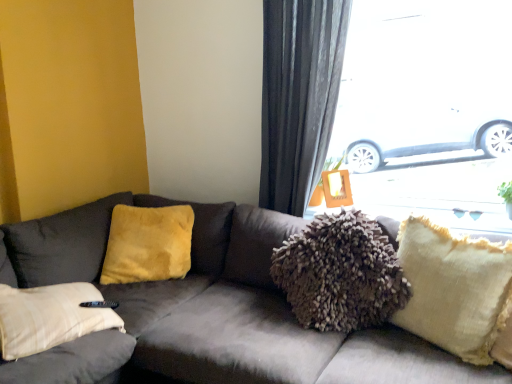
Question: Is dark gray fabric curtain at upper right bigger than beige textured pillow at right, which appears as the second pillow when viewed from the back?

Choices:
 (A) yes
 (B) no

Answer: (A)

Question: Does dark gray fabric curtain at upper right have a lesser height compared to beige textured pillow at right, the second pillow when ordered from left to right?

Choices:
 (A) no
 (B) yes

Answer: (A)

Question: Is dark gray fabric curtain at upper right closer to camera compared to beige textured pillow at right, the second pillow when ordered from left to right?

Choices:
 (A) no
 (B) yes

Answer: (A)

Question: Is dark gray fabric curtain at upper right at the left side of beige textured pillow at right, which is the first pillow from right to left?

Choices:
 (A) yes
 (B) no

Answer: (A)

Question: From the image's perspective, does dark gray fabric curtain at upper right appear lower than beige textured pillow at right, which appears as the second pillow when viewed from the back?

Choices:
 (A) yes
 (B) no

Answer: (B)

Question: Could you tell me if dark gray fabric curtain at upper right is facing beige textured pillow at right, which appears as the second pillow when viewed from the back?

Choices:
 (A) yes
 (B) no

Answer: (B)

Question: Is the position of transparent glass window at upper right less distant than that of fuzzy fabric pillow at upper right?

Choices:
 (A) no
 (B) yes

Answer: (B)

Question: From the image's perspective, is transparent glass window at upper right beneath fuzzy fabric pillow at upper right?

Choices:
 (A) no
 (B) yes

Answer: (A)

Question: Is transparent glass window at upper right positioned far away from fuzzy fabric pillow at upper right?

Choices:
 (A) no
 (B) yes

Answer: (A)

Question: Does transparent glass window at upper right have a greater height compared to fuzzy fabric pillow at upper right?

Choices:
 (A) no
 (B) yes

Answer: (B)

Question: Is transparent glass window at upper right turned away from fuzzy fabric pillow at upper right?

Choices:
 (A) no
 (B) yes

Answer: (A)

Question: Is the surface of transparent glass window at upper right in direct contact with fuzzy fabric pillow at upper right?

Choices:
 (A) yes
 (B) no

Answer: (B)

Question: Considering the relative sizes of velvet gray couch at center and beige textured pillow at right, which is the first pillow from right to left, in the image provided, is velvet gray couch at center bigger than beige textured pillow at right, which is the first pillow from right to left,?

Choices:
 (A) no
 (B) yes

Answer: (B)